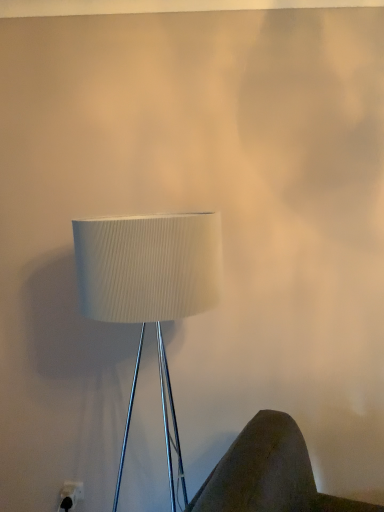
Describe the element at coordinates (149, 288) in the screenshot. I see `white ribbed fabric lampshade at center` at that location.

Locate an element on the screen. This screenshot has height=512, width=384. white ribbed fabric lampshade at center is located at coordinates (149, 288).

Identify the location of white ribbed fabric lampshade at center. The image size is (384, 512). pyautogui.click(x=149, y=288).